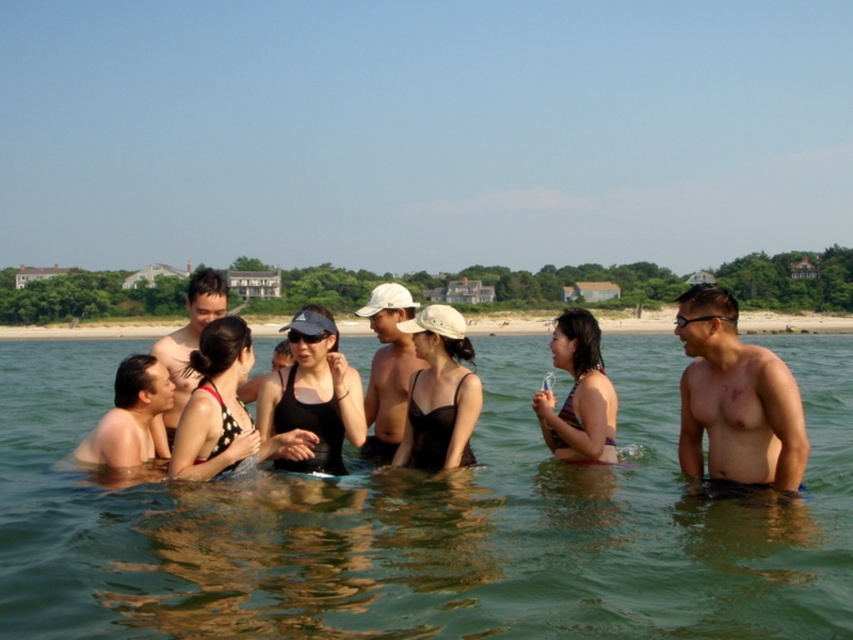
Question: Which of the following is the closest to the observer?

Choices:
 (A) (316, 323)
 (B) (22, 608)
 (C) (155, 376)

Answer: (B)

Question: Which of these objects is positioned closest to the black matte swimsuit at center?

Choices:
 (A) purple bikini at center
 (B) green water at center
 (C) matte black swimsuit at center
 (D) smooth skin man at lower left

Answer: (C)

Question: Is matte black swimsuit at center positioned at the back of smooth skin man at lower left?

Choices:
 (A) yes
 (B) no

Answer: (A)

Question: Does green water at center appear over black swimsuit at center?

Choices:
 (A) no
 (B) yes

Answer: (A)

Question: Which of the following is the farthest from the observer?

Choices:
 (A) purple bikini at center
 (B) smooth skin torso at center
 (C) black swimsuit at center

Answer: (A)

Question: Does green water at center have a greater width compared to matte black swimsuit at center?

Choices:
 (A) yes
 (B) no

Answer: (A)